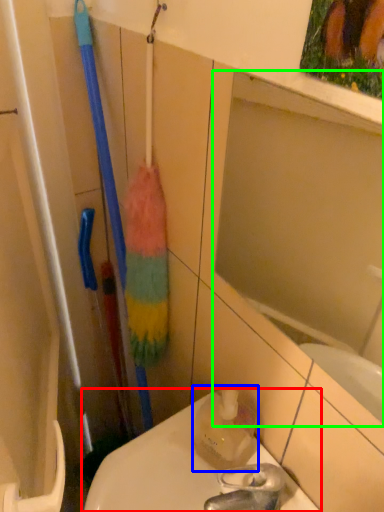
Question: Which object is the farthest from toilet (highlighted by a red box)? Choose among these: cleaning product (highlighted by a blue box) or mirror (highlighted by a green box).

Choices:
 (A) cleaning product
 (B) mirror

Answer: (B)